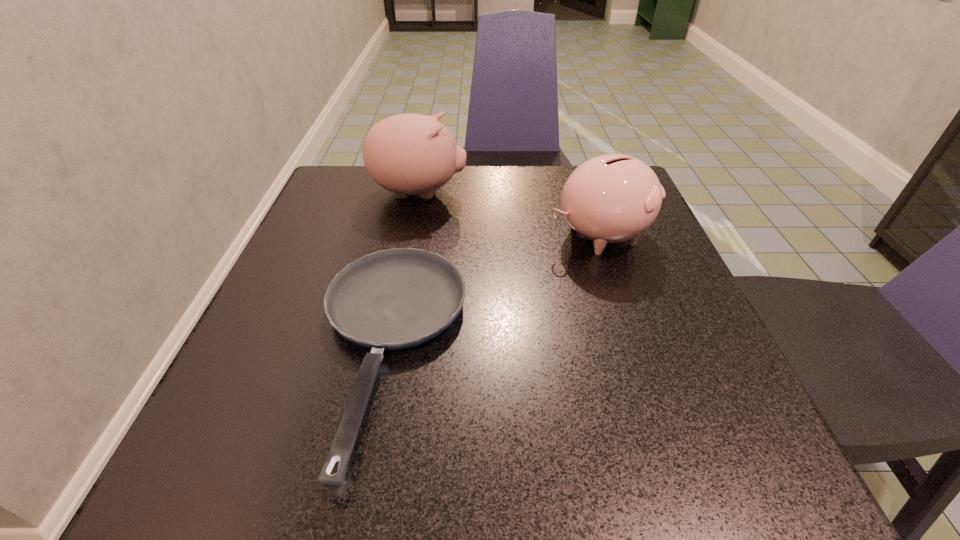
The height and width of the screenshot is (540, 960). Identify the location of vacant area in the image that satisfies the following two spatial constraints: 1. at the snout of the left piggy bank; 2. on the right side of the right piggy bank. (411, 235).

Find the location of a particular element. Image resolution: width=960 pixels, height=540 pixels. free spot that satisfies the following two spatial constraints: 1. at the snout of the left piggy bank; 2. on the left side of the shortest object is located at coordinates (388, 351).

Locate an element on the screen. The height and width of the screenshot is (540, 960). vacant space that satisfies the following two spatial constraints: 1. on the back side of the shortest object; 2. at the snout of the left piggy bank is located at coordinates (420, 193).

Locate an element on the screen. The width and height of the screenshot is (960, 540). free point that satisfies the following two spatial constraints: 1. at the snout of the left piggy bank; 2. on the back side of the rightmost object is located at coordinates (411, 235).

This screenshot has height=540, width=960. I want to click on vacant point that satisfies the following two spatial constraints: 1. at the snout of the rightmost object; 2. on the right side of the left piggy bank, so click(411, 235).

Identify the location of free location that satisfies the following two spatial constraints: 1. at the snout of the left piggy bank; 2. on the left side of the right piggy bank. The width and height of the screenshot is (960, 540). (411, 235).

You are a GUI agent. You are given a task and a screenshot of the screen. Output one action in this format:
    pyautogui.click(x=<x>, y=<y>)
    Task: Click on the free space that satisfies the following two spatial constraints: 1. at the snout of the right piggy bank; 2. on the left side of the left piggy bank
    Image resolution: width=960 pixels, height=540 pixels.
    Given the screenshot: What is the action you would take?
    pyautogui.click(x=411, y=235)

You are a GUI agent. You are given a task and a screenshot of the screen. Output one action in this format:
    pyautogui.click(x=<x>, y=<y>)
    Task: Click on the free spot that satisfies the following two spatial constraints: 1. on the back side of the shortest object; 2. on the left side of the right piggy bank
    This screenshot has height=540, width=960.
    Given the screenshot: What is the action you would take?
    pyautogui.click(x=411, y=235)

This screenshot has width=960, height=540. In order to click on vacant point that satisfies the following two spatial constraints: 1. at the snout of the right piggy bank; 2. on the left side of the left piggy bank in this screenshot , I will do `click(411, 235)`.

Find the location of a particular element. This screenshot has height=540, width=960. free location that satisfies the following two spatial constraints: 1. at the snout of the left piggy bank; 2. on the back side of the frying pan is located at coordinates (388, 351).